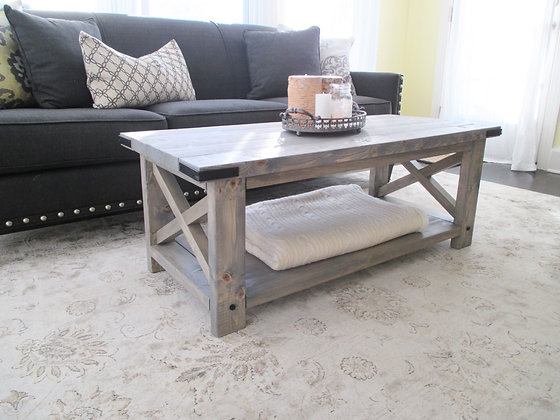
Where is `candle`? The width and height of the screenshot is (560, 420). candle is located at coordinates (325, 106).